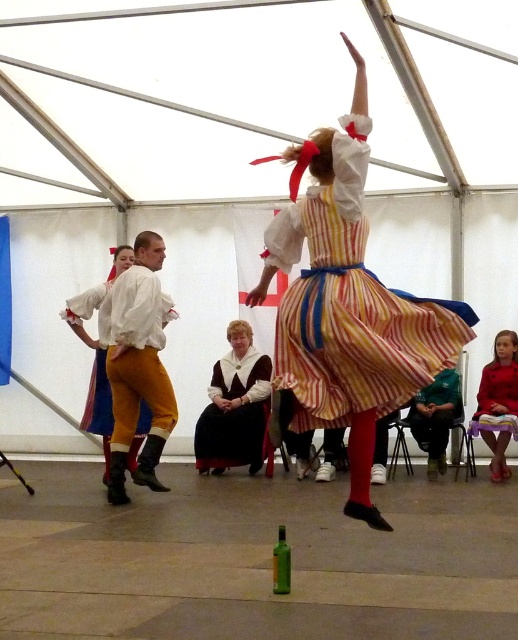
Question: Which object appears farthest from the camera in this image?

Choices:
 (A) green fabric pants at lower right
 (B) matte yellow trousers at center
 (C) striped cotton dress at center

Answer: (A)

Question: Does matte yellow trousers at center have a larger size compared to green fabric pants at lower right?

Choices:
 (A) no
 (B) yes

Answer: (B)

Question: Does green fabric pants at lower right appear over velvet red dress at center?

Choices:
 (A) no
 (B) yes

Answer: (A)

Question: Which of the following is the closest to the observer?

Choices:
 (A) (508, 381)
 (B) (247, 392)

Answer: (A)

Question: Does matte yellow trousers at center appear under velvet brown dress at center?

Choices:
 (A) yes
 (B) no

Answer: (B)

Question: Which point is farther from the camera taking this photo?

Choices:
 (A) (425, 448)
 (B) (120, 378)
 (C) (502, 413)

Answer: (A)